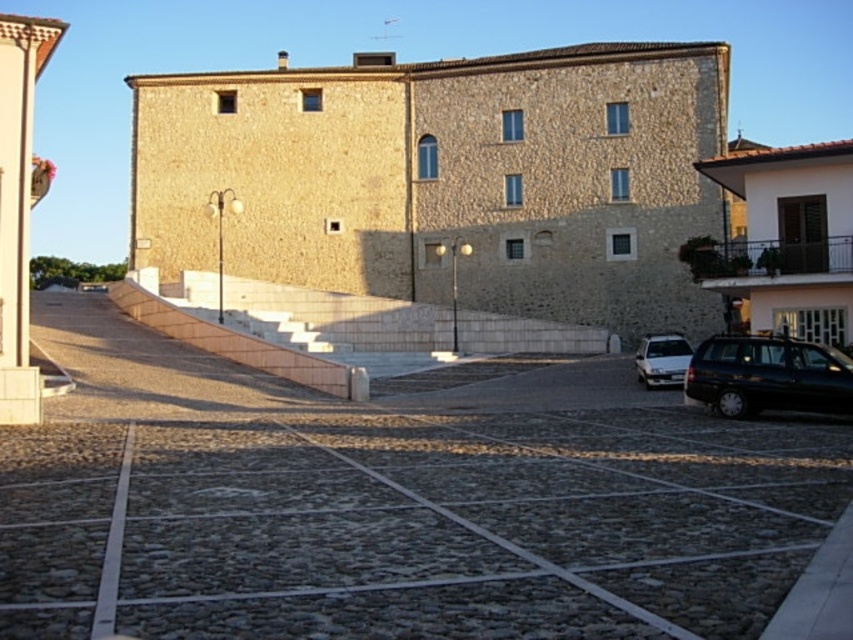
Is point (727, 285) more distant than point (689, 344)?

No, (727, 285) is in front of (689, 344).

Is metallic black balustrade at upper right below silver metallic sedan at lower right?

Incorrect, metallic black balustrade at upper right is not positioned below silver metallic sedan at lower right.

Between point (700, 262) and point (643, 372), which one is positioned in front?

Positioned in front is point (700, 262).

Locate an element on the screen. The width and height of the screenshot is (853, 640). metallic black balustrade at upper right is located at coordinates (770, 262).

Does cobblestone parking lot at center appear on the right side of shiny black car at lower right?

No, cobblestone parking lot at center is not to the right of shiny black car at lower right.

Between cobblestone parking lot at center and shiny black car at lower right, which one appears on the right side from the viewer's perspective?

shiny black car at lower right

Is point (694, 582) closer to viewer compared to point (746, 360)?

Yes, point (694, 582) is closer to viewer.

This screenshot has height=640, width=853. In order to click on cobblestone parking lot at center in this screenshot , I will do `click(402, 504)`.

Does cobblestone parking lot at center appear on the left side of silver metallic sedan at lower right?

Indeed, cobblestone parking lot at center is positioned on the left side of silver metallic sedan at lower right.

Which is above, cobblestone parking lot at center or silver metallic sedan at lower right?

silver metallic sedan at lower right is above.

Is point (78, 324) less distant than point (660, 385)?

No, (78, 324) is further to viewer.

Locate an element on the screen. cobblestone parking lot at center is located at coordinates (402, 504).